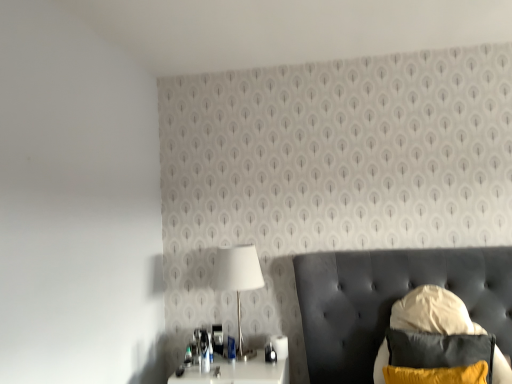
Question: In terms of width, does white glossy table at lower left look wider or thinner when compared to velvet yellow pillow at lower right?

Choices:
 (A) thin
 (B) wide

Answer: (B)

Question: Is white glossy table at lower left inside the boundaries of velvet yellow pillow at lower right, or outside?

Choices:
 (A) inside
 (B) outside

Answer: (B)

Question: Which is nearer to the velvet black swivel chair at lower right?

Choices:
 (A) white glossy lamp at center
 (B) white glossy nightstand at lower center
 (C) white glossy table at lower left
 (D) velvet yellow pillow at lower right

Answer: (D)

Question: Based on their relative distances, which object is farther from the white glossy nightstand at lower center?

Choices:
 (A) velvet black swivel chair at lower right
 (B) velvet yellow pillow at lower right
 (C) white glossy table at lower left
 (D) white glossy lamp at center

Answer: (B)